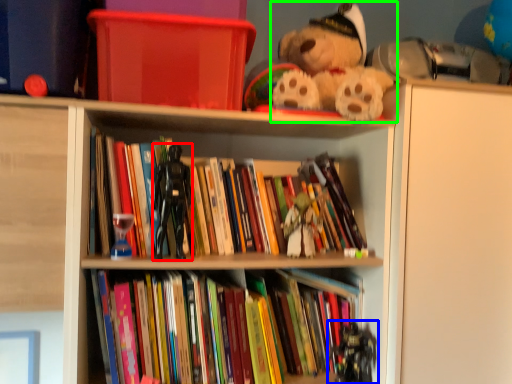
Question: Based on their relative distances, which object is nearer to miniature (highlighted by a red box)? Choose from toy (highlighted by a blue box) and teddy bear (highlighted by a green box).

Choices:
 (A) toy
 (B) teddy bear

Answer: (B)